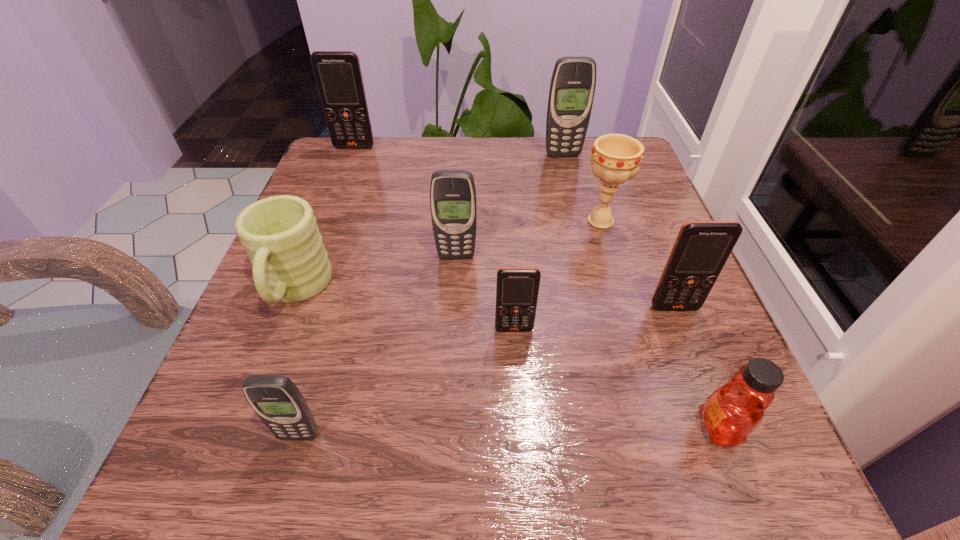
Where is `vacant space situated 0.210m on the side of the green mug with the handle`? The height and width of the screenshot is (540, 960). vacant space situated 0.210m on the side of the green mug with the handle is located at coordinates (227, 464).

This screenshot has width=960, height=540. Identify the location of free space located on the screen of the second nearest cellular telephone. (523, 470).

You are a GUI agent. You are given a task and a screenshot of the screen. Output one action in this format:
    pyautogui.click(x=<x>, y=<y>)
    Task: Click on the blank space located 0.080m on the screen of the nearest cellular telephone
    
    Given the screenshot: What is the action you would take?
    pyautogui.click(x=277, y=507)

Where is `free region located 0.220m on the front label of the honey`? free region located 0.220m on the front label of the honey is located at coordinates (531, 427).

At what (x,y) coordinates should I click in order to perform the action: click on vacant space located 0.100m on the front label of the honey. Please return your answer as a coordinate pair (x, y). This screenshot has width=960, height=540. Looking at the image, I should click on (621, 427).

At what (x,y) coordinates should I click in order to perform the action: click on vacant space located 0.260m on the front label of the honey. Please return your answer as a coordinate pair (x, y). The image size is (960, 540). Looking at the image, I should click on (501, 427).

Where is `cellular telephone that is at the near edge`? The width and height of the screenshot is (960, 540). cellular telephone that is at the near edge is located at coordinates click(277, 401).

The image size is (960, 540). I want to click on honey at the near edge, so click(x=733, y=411).

This screenshot has width=960, height=540. Identify the location of mug that is at the left edge. (290, 264).

Locate an element on the screen. The height and width of the screenshot is (540, 960). chalice positioned at the right edge is located at coordinates (615, 158).